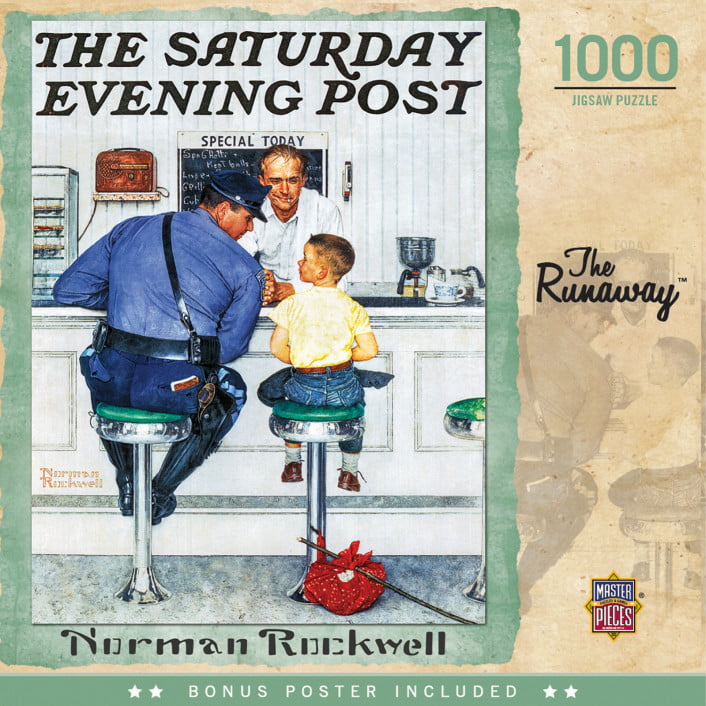
Locate an element on the screen. This screenshot has width=706, height=706. diner is located at coordinates (394, 301).